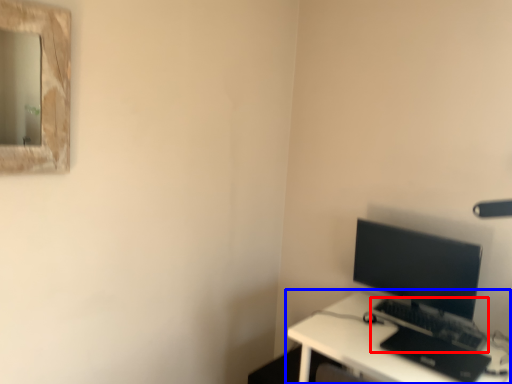
Question: Which object is closer to the camera taking this photo, computer keyboard (highlighted by a red box) or desk (highlighted by a blue box)?

Choices:
 (A) computer keyboard
 (B) desk

Answer: (B)